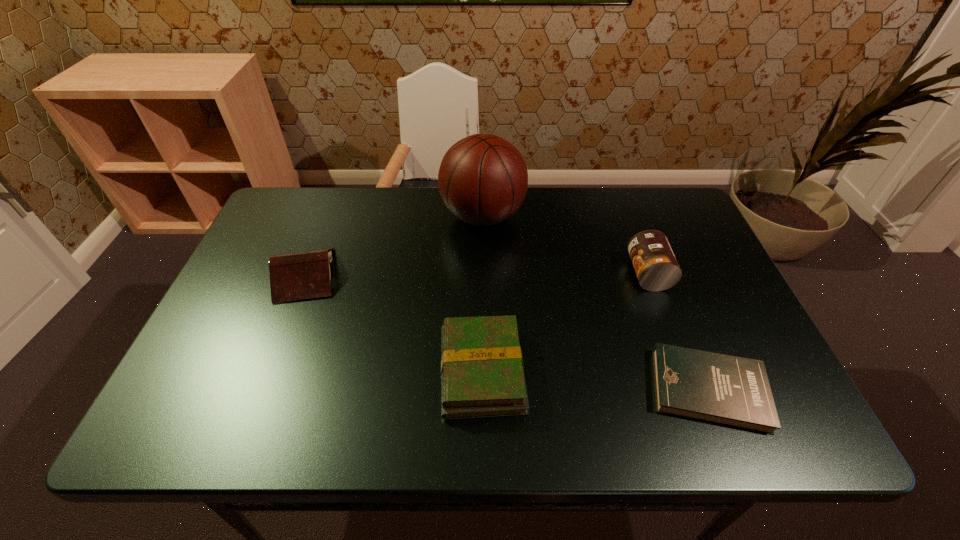
Where is `vacant area that lies between the can and the tallest object`? vacant area that lies between the can and the tallest object is located at coordinates (565, 245).

This screenshot has height=540, width=960. In order to click on unoccupied area between the second book from left to right and the rightmost book in this screenshot , I will do `click(595, 380)`.

The image size is (960, 540). I want to click on free space between the second book from right to left and the farthest object, so click(x=482, y=293).

Locate an element on the screen. The height and width of the screenshot is (540, 960). free space between the can and the second book from left to right is located at coordinates click(565, 322).

Locate an element on the screen. This screenshot has height=540, width=960. vacant area that lies between the leftmost object and the basketball is located at coordinates (395, 245).

In order to click on vacant space that's between the basketball and the second book from right to left in this screenshot , I will do `click(482, 293)`.

The height and width of the screenshot is (540, 960). What are the coordinates of `the fourth closest object to the second book from right to left` in the screenshot? It's located at (656, 267).

Where is `object that stands as the second closest to the rightmost book`? The height and width of the screenshot is (540, 960). object that stands as the second closest to the rightmost book is located at coordinates (482, 374).

This screenshot has width=960, height=540. I want to click on book that is the second closest to the farthest book, so click(733, 391).

What are the coordinates of `the closest book to the shortest object` in the screenshot? It's located at (482, 374).